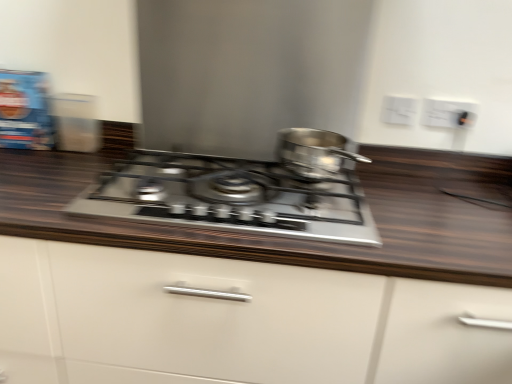
Question: Does white matte cabinet at center have a greater width compared to satin silver gas stove at center?

Choices:
 (A) yes
 (B) no

Answer: (A)

Question: From the image's perspective, is white matte cabinet at center over satin silver gas stove at center?

Choices:
 (A) yes
 (B) no

Answer: (B)

Question: Considering the relative sizes of white matte cabinet at center and satin silver gas stove at center in the image provided, is white matte cabinet at center shorter than satin silver gas stove at center?

Choices:
 (A) yes
 (B) no

Answer: (B)

Question: Is white matte cabinet at center smaller than satin silver gas stove at center?

Choices:
 (A) yes
 (B) no

Answer: (B)

Question: From a real-world perspective, is white matte cabinet at center located higher than satin silver gas stove at center?

Choices:
 (A) no
 (B) yes

Answer: (A)

Question: Looking at their shapes, would you say white plastic electric outlet at upper right, positioned as the 1th electric outlet in right-to-left order, is wider or thinner than white matte cabinet at center?

Choices:
 (A) thin
 (B) wide

Answer: (A)

Question: From the image's perspective, is white plastic electric outlet at upper right, acting as the second electric outlet starting from the left, above or below white matte cabinet at center?

Choices:
 (A) below
 (B) above

Answer: (B)

Question: From a real-world perspective, is white plastic electric outlet at upper right, positioned as the 1th electric outlet in right-to-left order, positioned above or below white matte cabinet at center?

Choices:
 (A) below
 (B) above

Answer: (B)

Question: In the image, is white plastic electric outlet at upper right, acting as the second electric outlet starting from the left, positioned in front of or behind white matte cabinet at center?

Choices:
 (A) front
 (B) behind

Answer: (B)

Question: Considering the positions of point (286, 311) and point (432, 125), is point (286, 311) closer or farther from the camera than point (432, 125)?

Choices:
 (A) closer
 (B) farther

Answer: (A)

Question: In terms of height, does white matte cabinet at center look taller or shorter compared to white plastic electric outlet at upper right, positioned as the 1th electric outlet in right-to-left order?

Choices:
 (A) tall
 (B) short

Answer: (A)

Question: From a real-world perspective, relative to white plastic electric outlet at upper right, positioned as the 1th electric outlet in right-to-left order, is white matte cabinet at center vertically above or below?

Choices:
 (A) above
 (B) below

Answer: (B)

Question: Relative to white plastic electric outlet at upper right, positioned as the 1th electric outlet in right-to-left order, is white matte cabinet at center in front or behind?

Choices:
 (A) behind
 (B) front

Answer: (B)

Question: Based on their positions, is satin silver gas stove at center located to the left or right of white matte cabinet at center?

Choices:
 (A) left
 (B) right

Answer: (A)

Question: Considering the positions of satin silver gas stove at center and white matte cabinet at center in the image, is satin silver gas stove at center wider or thinner than white matte cabinet at center?

Choices:
 (A) thin
 (B) wide

Answer: (A)